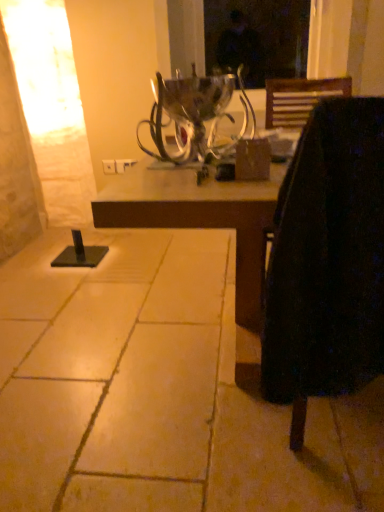
Question: Is black fabric chair at right in front of or behind brown tile floor at lower left in the image?

Choices:
 (A) behind
 (B) front

Answer: (B)

Question: From the image's perspective, is black fabric chair at right above or below brown tile floor at lower left?

Choices:
 (A) below
 (B) above

Answer: (B)

Question: Which is nearer to the brown tile floor at lower left?

Choices:
 (A) matte brown table at center
 (B) metallic silver candle holder at center
 (C) black fabric chair at right

Answer: (A)

Question: Considering the real-world distances, which object is farthest from the matte brown table at center?

Choices:
 (A) brown tile floor at lower left
 (B) black fabric chair at right
 (C) metallic silver candle holder at center

Answer: (C)